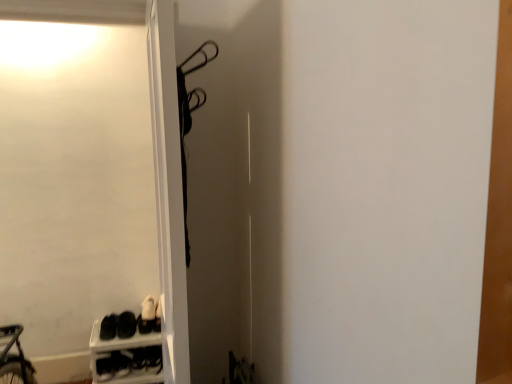
Question: Does black matte shoes at lower left, the first footwear in the left-to-right sequence, turn towards white plastic shoe rack at lower left?

Choices:
 (A) yes
 (B) no

Answer: (B)

Question: Is black matte shoes at lower left, the 3th footwear when ordered from right to left, facing away from white plastic shoe rack at lower left?

Choices:
 (A) yes
 (B) no

Answer: (B)

Question: Does black matte shoes at lower left, the first footwear in the left-to-right sequence, have a smaller size compared to white plastic shoe rack at lower left?

Choices:
 (A) no
 (B) yes

Answer: (B)

Question: From a real-world perspective, does black matte shoes at lower left, the 3th footwear when ordered from right to left, stand above white plastic shoe rack at lower left?

Choices:
 (A) no
 (B) yes

Answer: (B)

Question: Is black matte shoes at lower left, the first footwear in the left-to-right sequence, to the left of white plastic shoe rack at lower left from the viewer's perspective?

Choices:
 (A) no
 (B) yes

Answer: (B)

Question: Is the position of black matte shoes at lower left, the 3th footwear when ordered from right to left, more distant than that of white plastic shoe rack at lower left?

Choices:
 (A) no
 (B) yes

Answer: (B)

Question: Does black matte shoes at lower left, the 3th footwear when ordered from right to left, have a greater height compared to white leather shoe at lower left?

Choices:
 (A) no
 (B) yes

Answer: (B)

Question: Considering the relative sizes of black matte shoes at lower left, the first footwear in the left-to-right sequence, and white leather shoe at lower left in the image provided, is black matte shoes at lower left, the first footwear in the left-to-right sequence, wider than white leather shoe at lower left?

Choices:
 (A) no
 (B) yes

Answer: (B)

Question: From the image's perspective, does black matte shoes at lower left, the 3th footwear when ordered from right to left, appear lower than white leather shoe at lower left?

Choices:
 (A) yes
 (B) no

Answer: (B)

Question: From the image's perspective, is black matte shoes at lower left, the 3th footwear when ordered from right to left, on top of white leather shoe at lower left?

Choices:
 (A) yes
 (B) no

Answer: (A)

Question: Could you tell me if black matte shoes at lower left, the first footwear in the left-to-right sequence, is turned towards white leather shoe at lower left?

Choices:
 (A) yes
 (B) no

Answer: (B)

Question: From a real-world perspective, is black matte shoes at lower left, the 3th footwear when ordered from right to left, on white leather shoe at lower left?

Choices:
 (A) yes
 (B) no

Answer: (A)

Question: Does black matte sneakers at lower left, which is the second footwear from left to right, have a lesser width compared to black matte shoes at lower left, the 3th footwear when ordered from right to left?

Choices:
 (A) yes
 (B) no

Answer: (A)